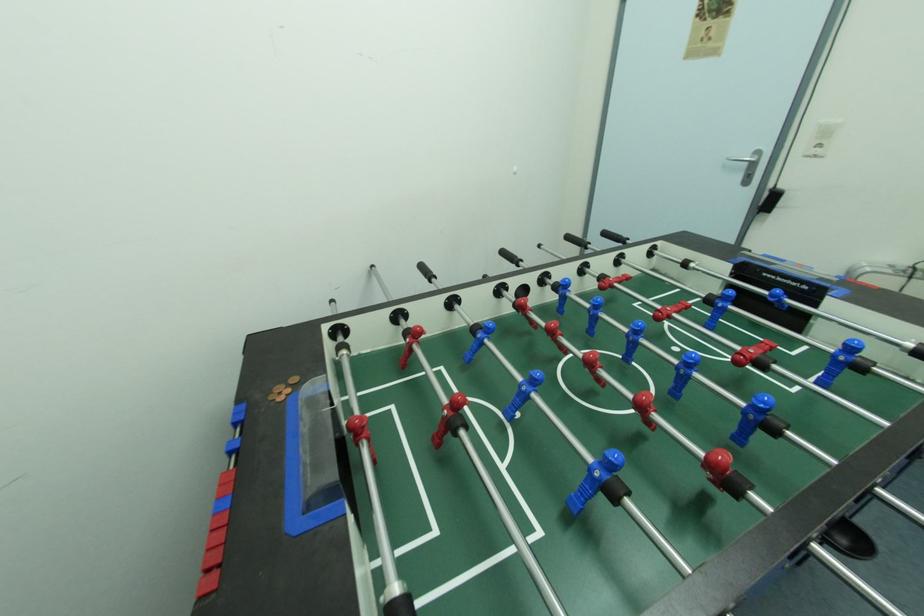
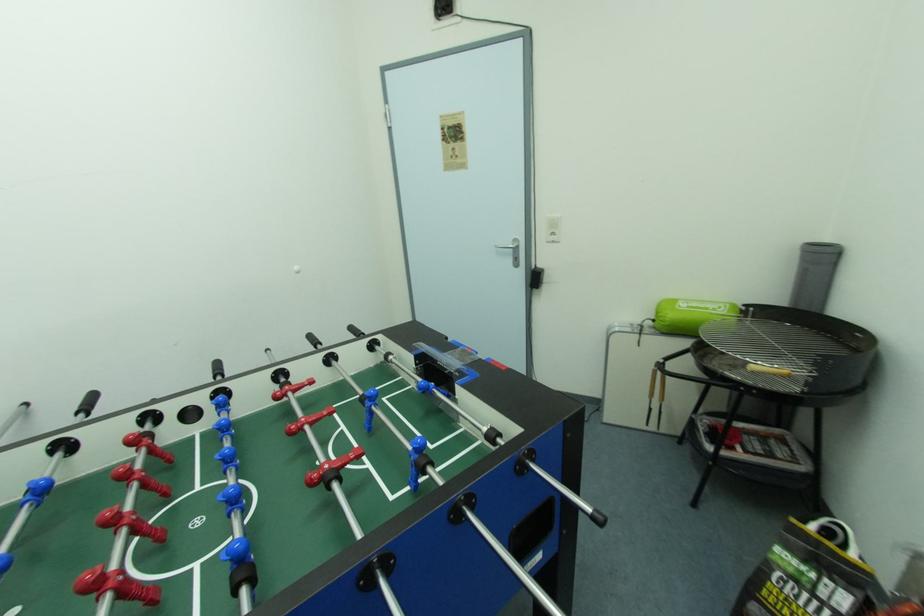
Question: The camera is either moving clockwise (left) or counter-clockwise (right) around the object. The first image is from the beginning of the video and the second image is from the end. Is the camera moving left or right when shooting the video?

Choices:
 (A) Left
 (B) Right

Answer: (A)